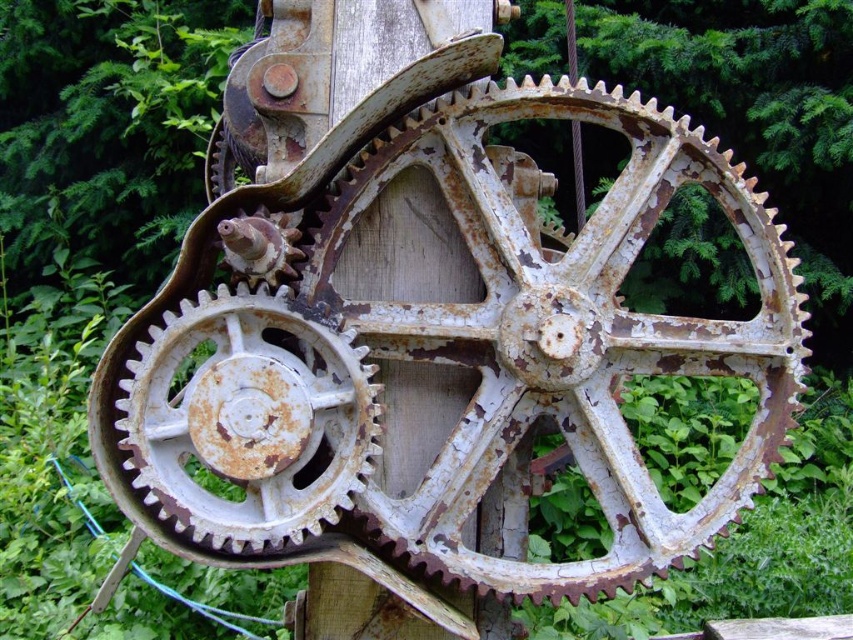
You are an engineer inspecting an old machine. You notice two gears in the center area of the mechanism. One is labeled as the rusty metal gear at center and the other as the rusty white gear at center. From your vantage point, which gear do you see first when looking directly at the mechanism?

The rusty metal gear at center is seen first because it is in front of the rusty white gear at center.

You are an engineer inspecting an old machine. You see the rusty metal gear at center and the rusty white gear at center. Which one has a greater width?

The rusty metal gear at center has a greater width than the rusty white gear at center.